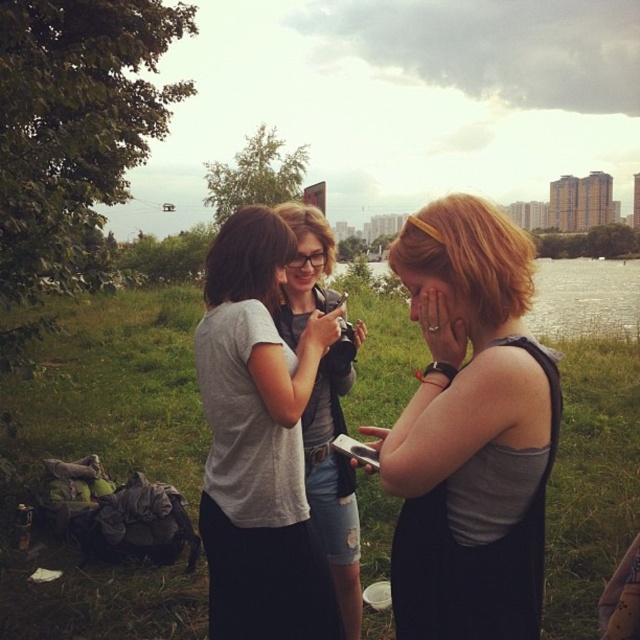
You are a photographer trying to capture a candid shot of the three people in the scene. You want to ensure that the matte black phone at center is not visible in the photo. Based on its position coordinates, can you estimate whether the phone is within the frame of the people or outside of it?

The matte black phone at center is positioned at coordinates point (333,486), which places it centrally within the frame of the three people, so it will be visible in the photo.